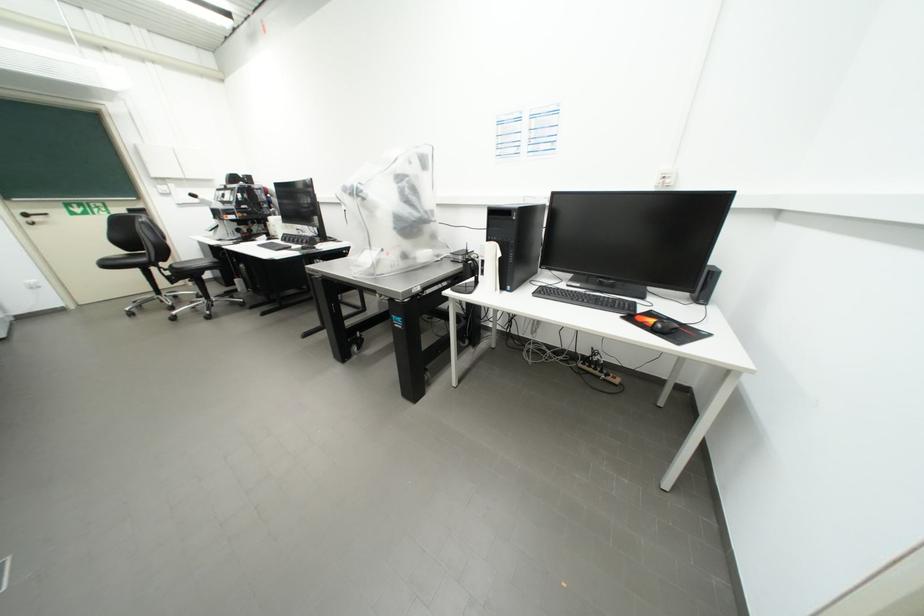
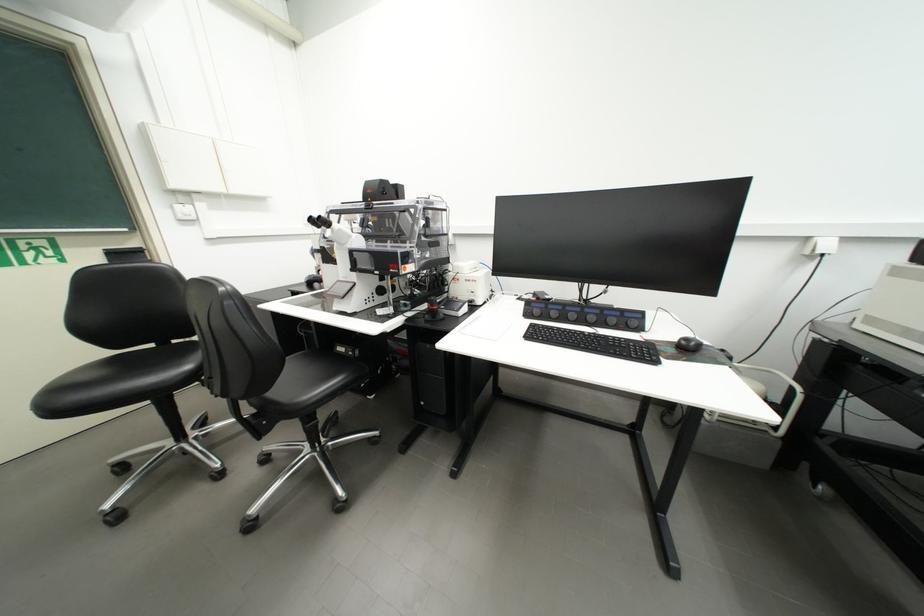
Looking at this image, in a continuous first-person perspective shot, in which direction is the camera moving?

The movement direction of the cameraman is left, forward.